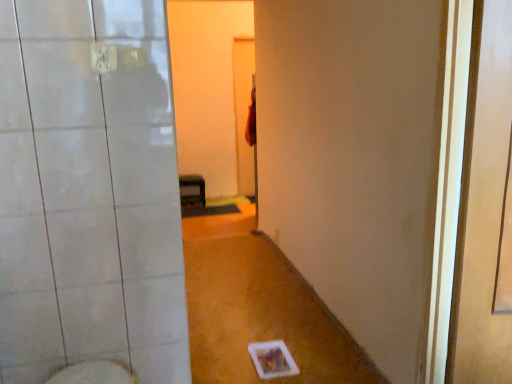
Question: Is white glossy bidet at lower left wider or thinner than transparent plastic screen door at right?

Choices:
 (A) wide
 (B) thin

Answer: (A)

Question: Would you say white glossy bidet at lower left is to the left or to the right of transparent plastic screen door at right in the picture?

Choices:
 (A) left
 (B) right

Answer: (A)

Question: Which object is positioned closest to the matte black shelf at center?

Choices:
 (A) white glossy bidet at lower left
 (B) transparent plastic screen door at right

Answer: (A)

Question: Which is nearer to the white glossy bidet at lower left?

Choices:
 (A) transparent plastic screen door at right
 (B) matte black shelf at center

Answer: (A)